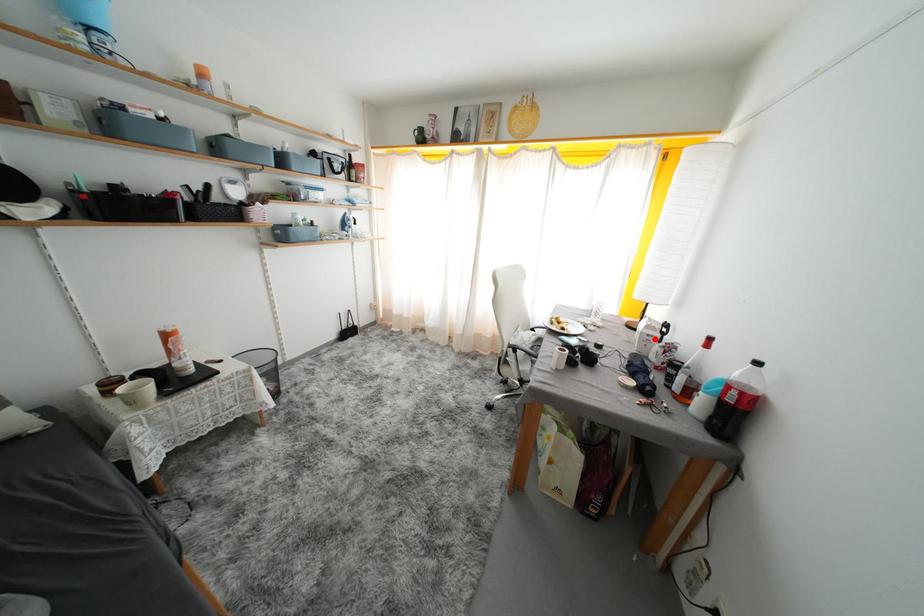
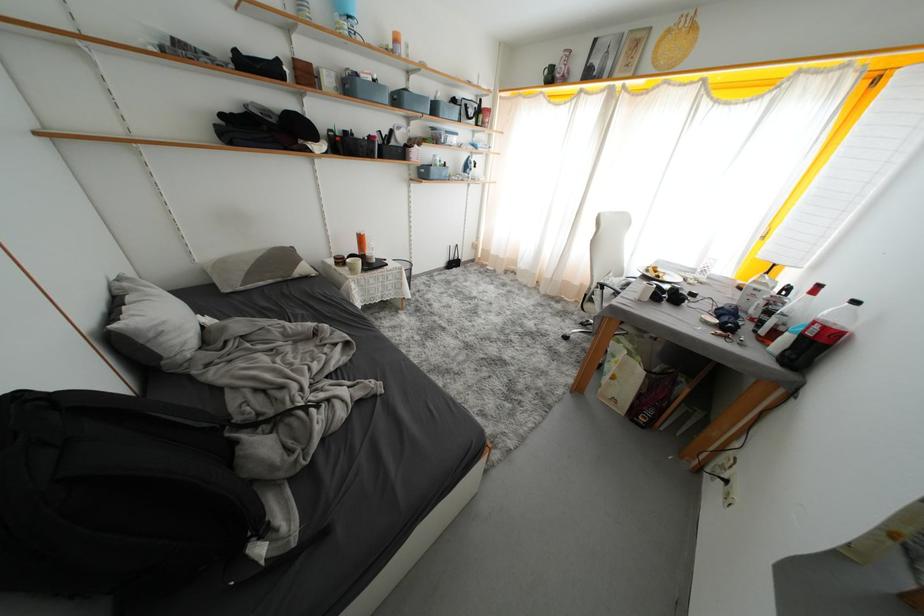
Question: I am providing you with two images of the same scene from different viewpoints. Given a red point in image1, look at the same physical point in image2. Is it:

Choices:
 (A) Closer to the viewpoint
 (B) Farther from the viewpoint

Answer: (B)